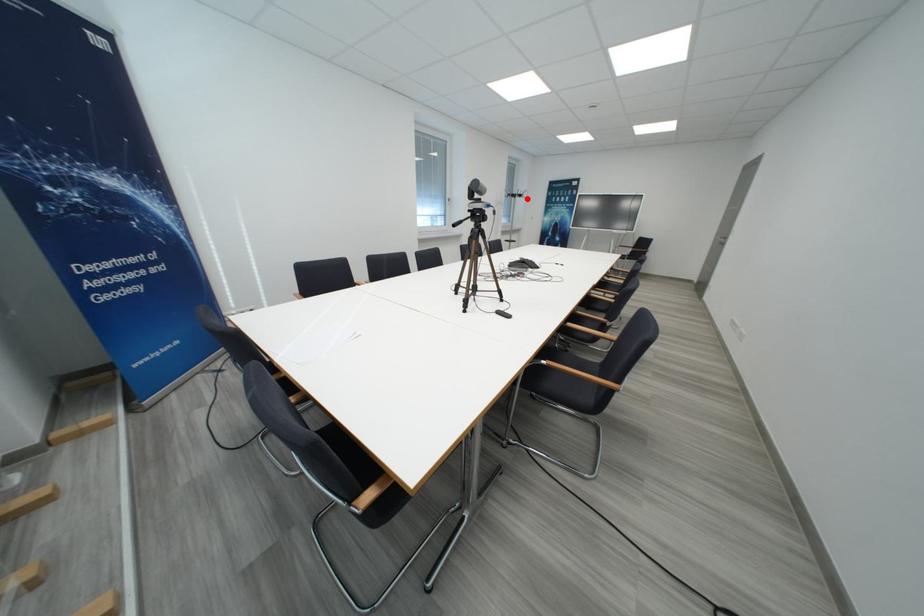
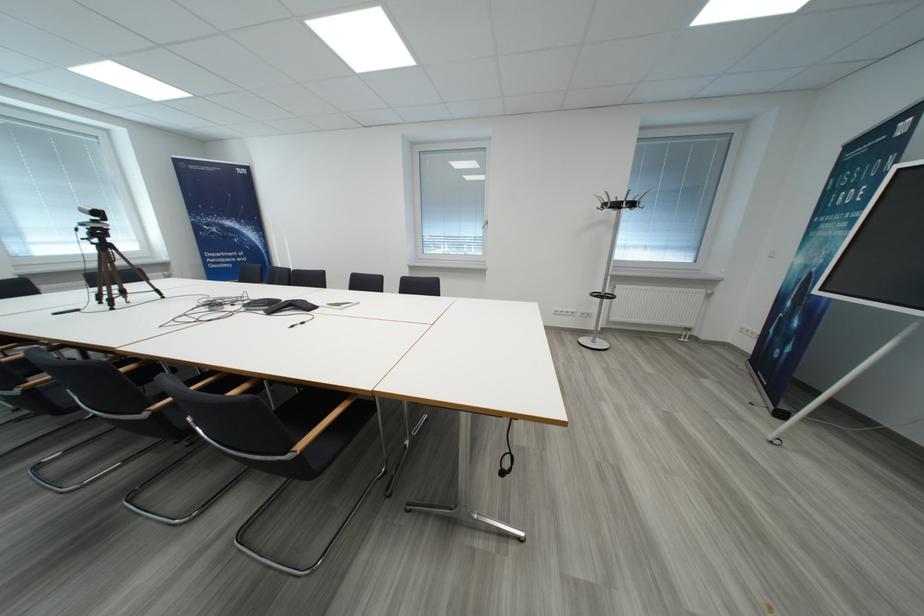
Question: I am providing you with two images of the same scene from different viewpoints. Given a red point in image1, look at the same physical point in image2. Is it:

Choices:
 (A) Closer to the viewpoint
 (B) Farther from the viewpoint

Answer: (B)